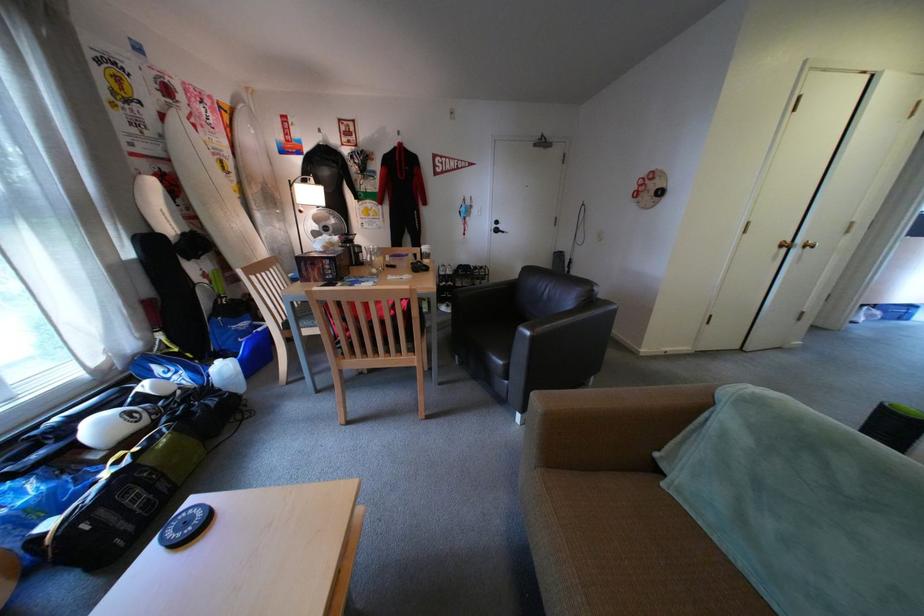
Where is `black door handle`? This screenshot has width=924, height=616. black door handle is located at coordinates (497, 230).